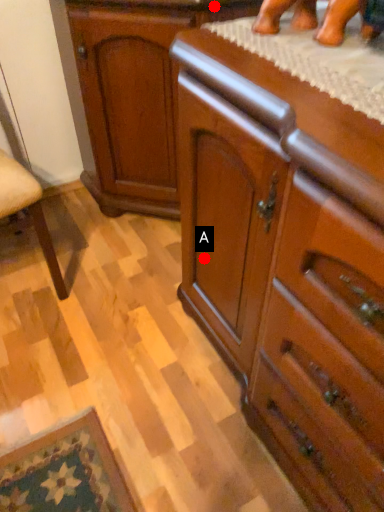
Question: Two points are circled on the image, labeled by A and B beside each circle. Among these points, which one is nearest to the camera?

Choices:
 (A) A is closer
 (B) B is closer

Answer: (B)